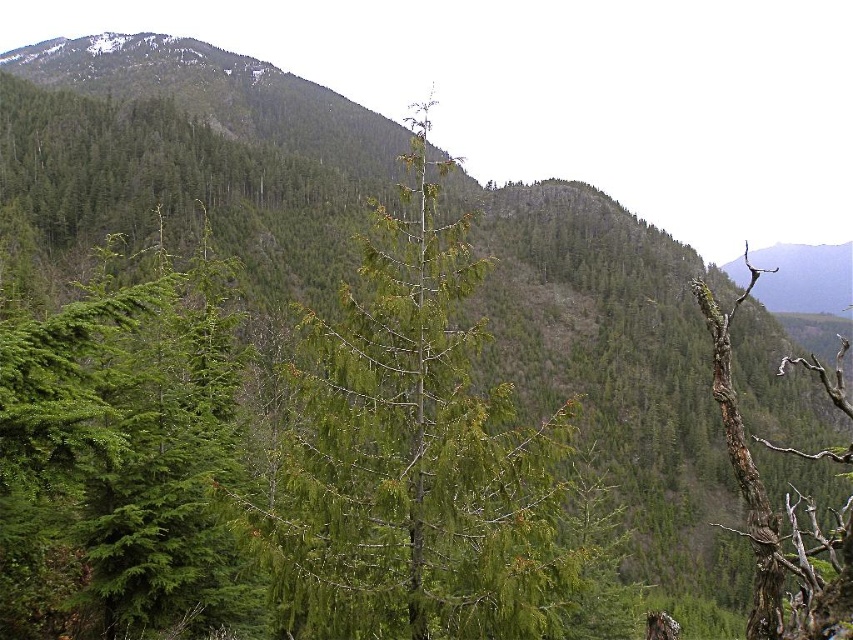
Question: Is green matte tree at left thinner than brown rough bark tree at right?

Choices:
 (A) yes
 (B) no

Answer: (A)

Question: Does green needle-like tree at center have a smaller size compared to brown rough bark tree at right?

Choices:
 (A) yes
 (B) no

Answer: (A)

Question: Among these objects, which one is farthest from the camera?

Choices:
 (A) green matte tree at left
 (B) green needle-like tree at center
 (C) brown rough bark tree at right

Answer: (A)

Question: Among these objects, which one is nearest to the camera?

Choices:
 (A) brown rough bark tree at right
 (B) green matte tree at left
 (C) green needle-like tree at center

Answer: (A)

Question: Is green matte tree at left bigger than brown rough bark tree at right?

Choices:
 (A) yes
 (B) no

Answer: (B)

Question: Which point appears closest to the camera in this image?

Choices:
 (A) (834, 627)
 (B) (80, 481)

Answer: (A)